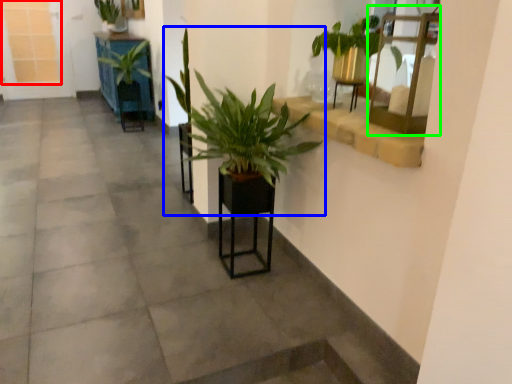
Question: Considering the real-world distances, which object is closest to window frame (highlighted by a red box)? houseplant (highlighted by a blue box) or shelf (highlighted by a green box).

Choices:
 (A) houseplant
 (B) shelf

Answer: (A)